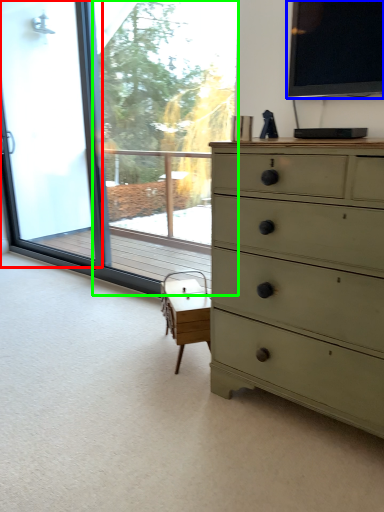
Question: Which object is positioned farthest from screen door (highlighted by a red box)? Select from window screen (highlighted by a blue box) and window screen (highlighted by a green box).

Choices:
 (A) window screen
 (B) window screen

Answer: (A)